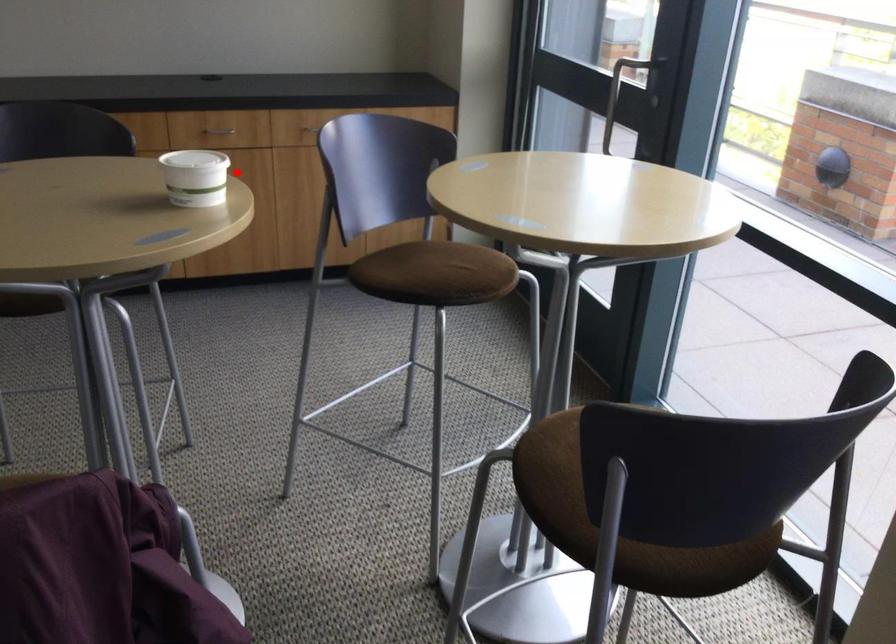
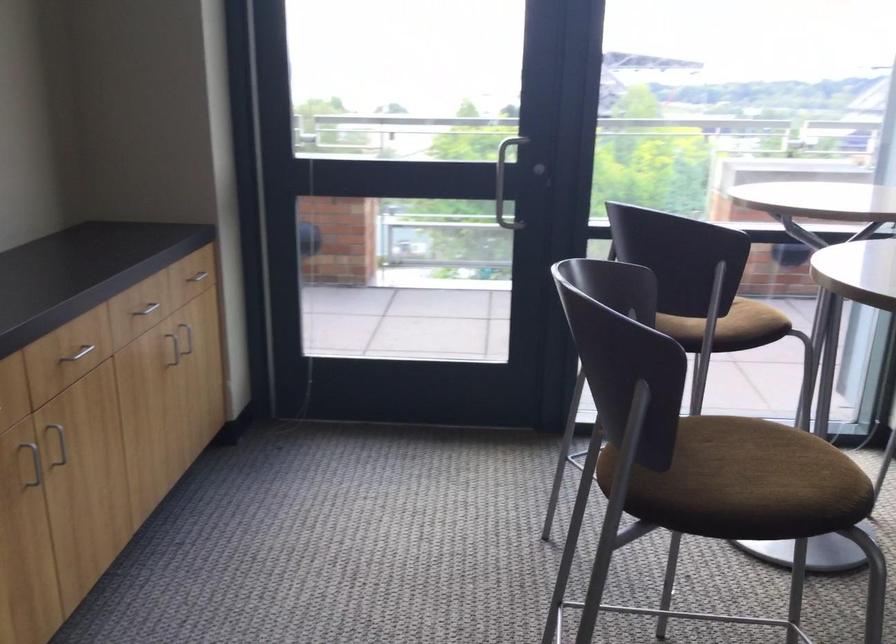
Find the pixel in the second image that matches the highlighted location in the first image.

(36, 465)